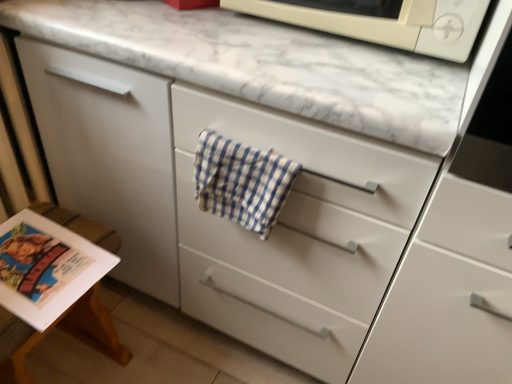
The height and width of the screenshot is (384, 512). I want to click on blank space situated above matte paper magazine at lower left (from a real-world perspective), so click(35, 274).